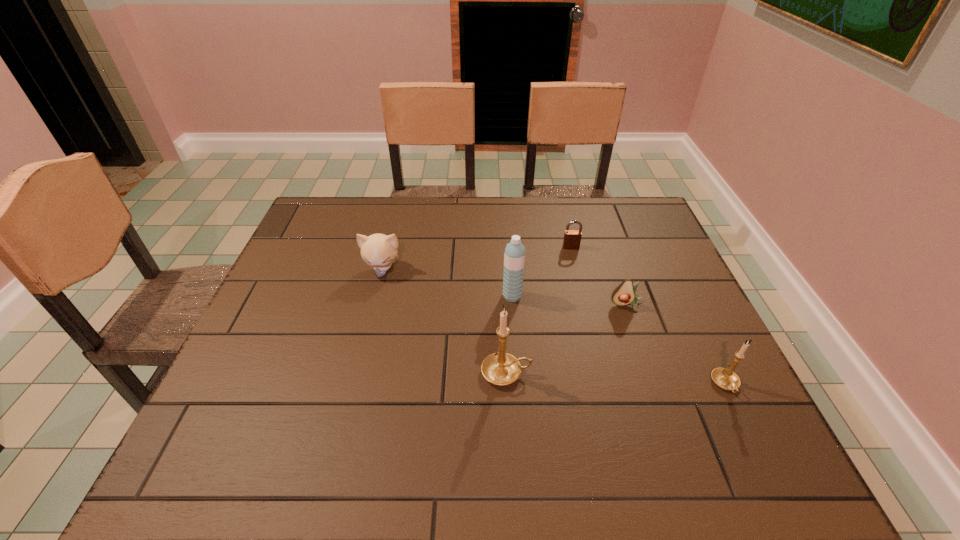
Where is `vacant space that is in between the right candle holder and the second object from right to left`? vacant space that is in between the right candle holder and the second object from right to left is located at coordinates (676, 345).

At what (x,y) coordinates should I click in order to perform the action: click on vacant area that lies between the avocado and the farthest object. Please return your answer as a coordinate pair (x, y). Looking at the image, I should click on (599, 276).

You are a GUI agent. You are given a task and a screenshot of the screen. Output one action in this format:
    pyautogui.click(x=<x>, y=<y>)
    Task: Click on the empty location between the right candle holder and the avocado
    
    Given the screenshot: What is the action you would take?
    pyautogui.click(x=676, y=345)

The image size is (960, 540). I want to click on unoccupied area between the taller candle holder and the third object from right to left, so click(x=539, y=310).

Locate which object is the fourth closest to the water bottle. Please provide its 2D coordinates. Your answer should be formatted as a tuple, i.e. [(x, y)], where the tuple contains the x and y coordinates of a point satisfying the conditions above.

[(378, 250)]

Where is `object that is the fourth closest to the right candle holder`? This screenshot has height=540, width=960. object that is the fourth closest to the right candle holder is located at coordinates (572, 238).